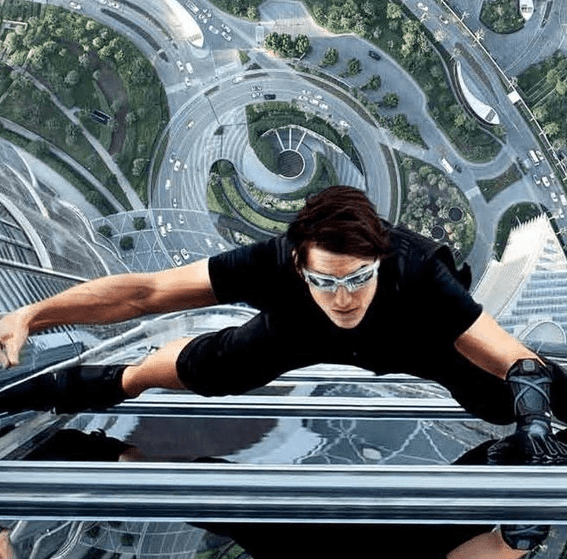
Locate an element on the screen. This screenshot has height=559, width=567. windows is located at coordinates (332, 452), (337, 393).